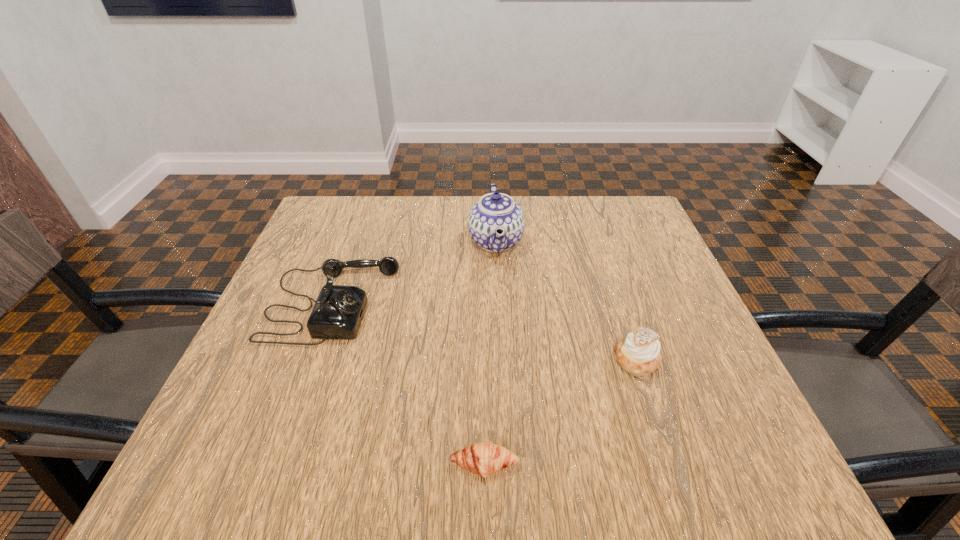
Locate an element on the screen. Image resolution: width=960 pixels, height=540 pixels. free location that satisfies the following two spatial constraints: 1. at the spout of the taller pastry; 2. on the left side of the tallest object is located at coordinates (501, 359).

Identify the location of vacant space that satisfies the following two spatial constraints: 1. at the spout of the tallest object; 2. on the front-facing side of the shortest object. The width and height of the screenshot is (960, 540). (506, 464).

The width and height of the screenshot is (960, 540). What are the coordinates of `vacant space that satisfies the following two spatial constraints: 1. on the dial of the telephone; 2. on the back side of the taller pastry` in the screenshot? It's located at (312, 359).